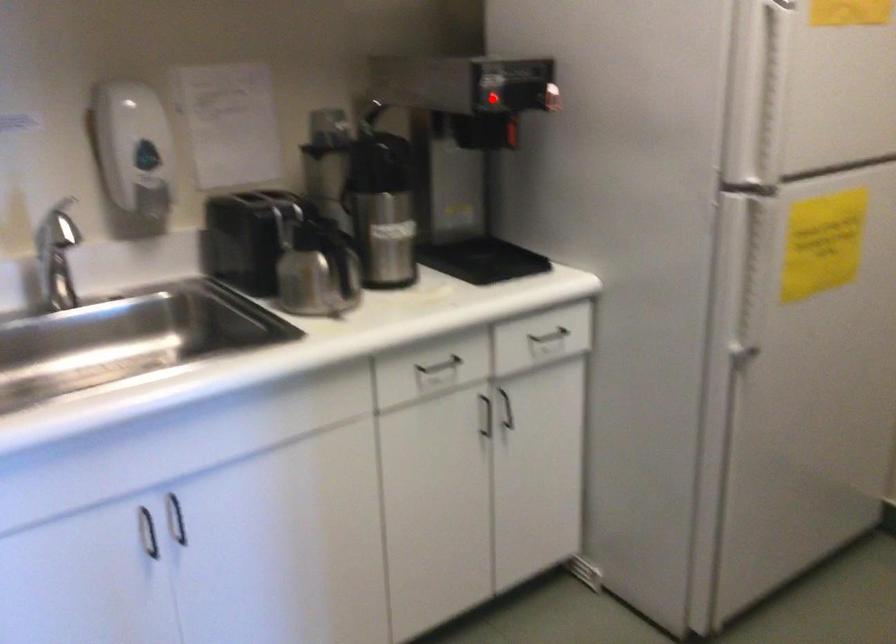
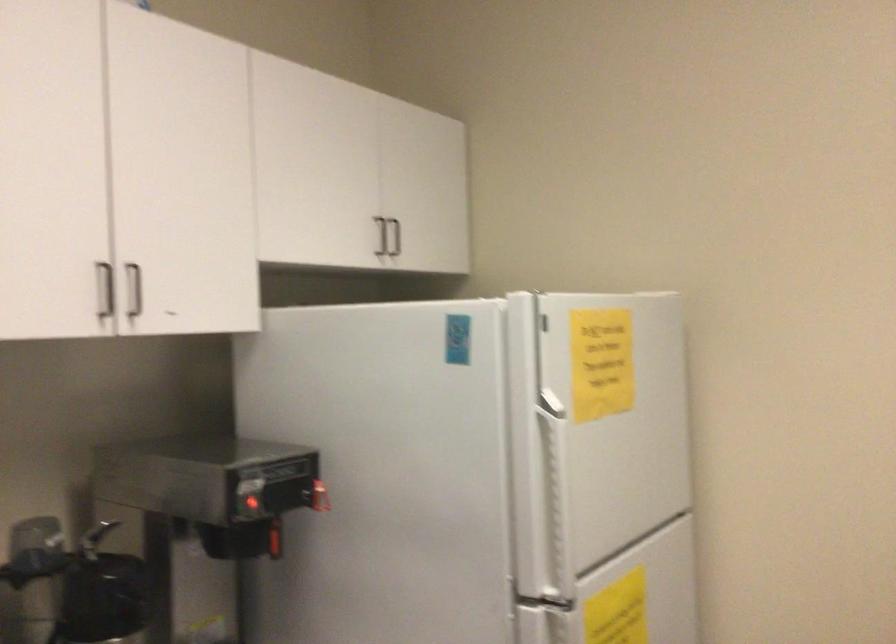
The point at the highlighted location is marked in the first image. Where is the corresponding point in the second image?

(250, 504)